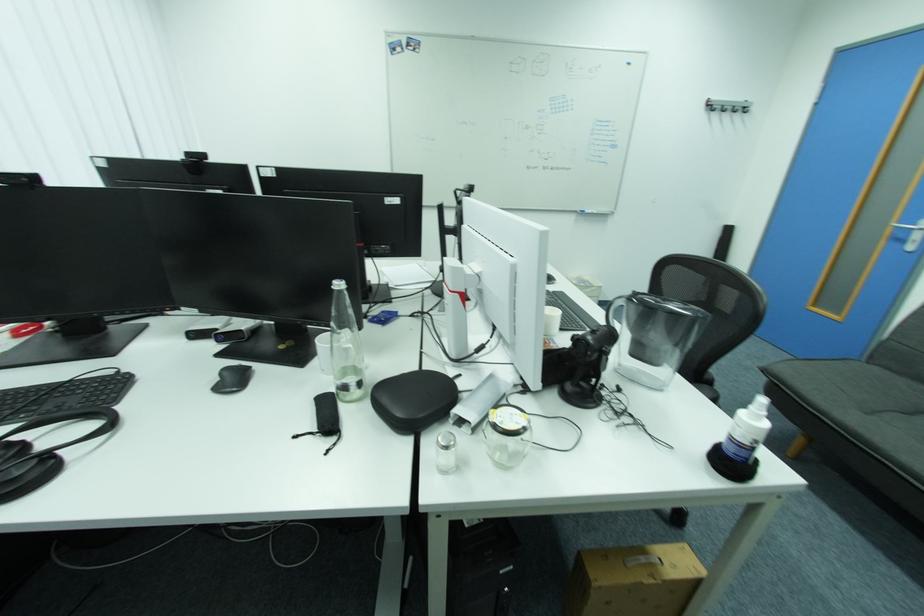
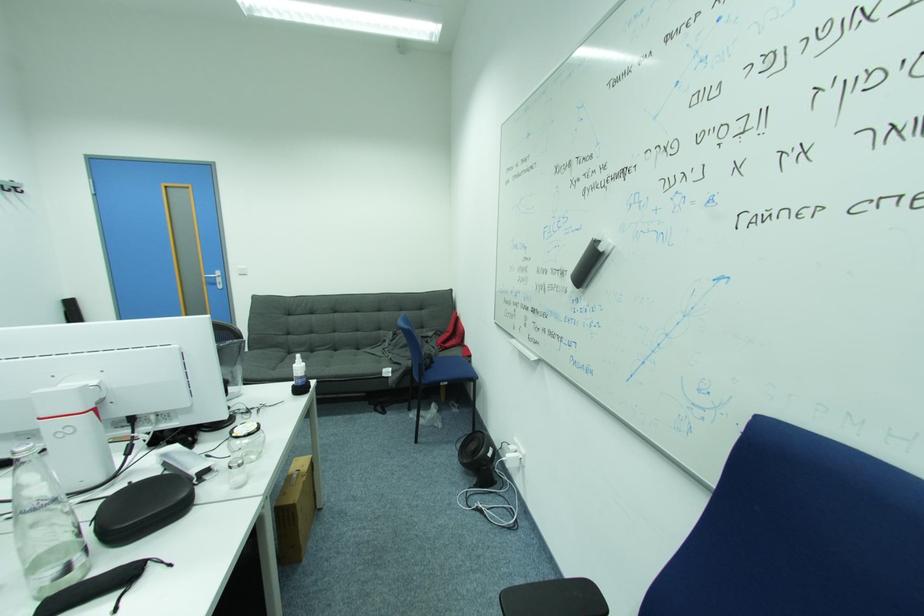
How did the camera likely rotate?

The camera's rotation is toward right-down.